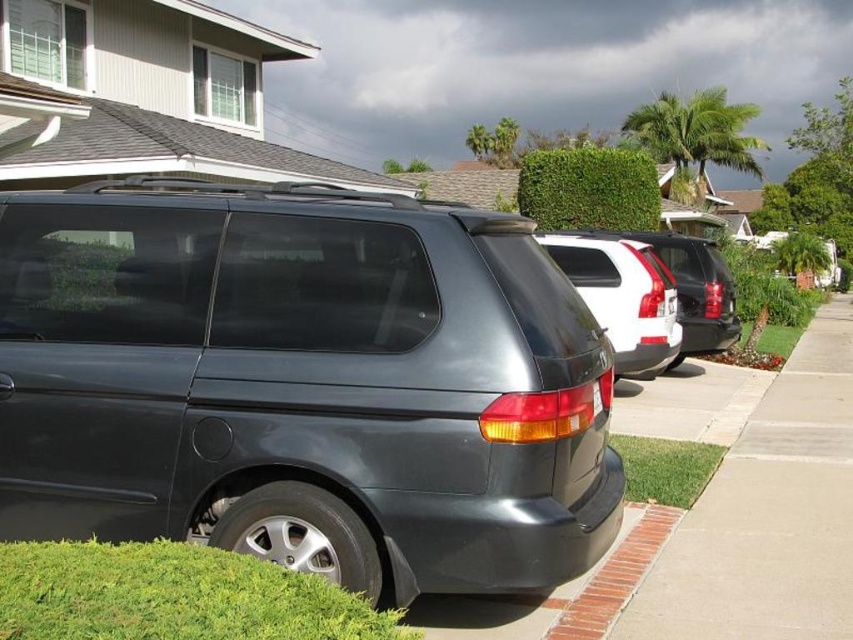
Question: Among these points, which one is farthest from the camera?

Choices:
 (A) coord(830,314)
 (B) coord(134,246)

Answer: (A)

Question: Does concrete at center appear on the left side of white matte suv at center?

Choices:
 (A) yes
 (B) no

Answer: (B)

Question: Can you confirm if satin dark gray minivan at center is positioned below concrete at center?

Choices:
 (A) yes
 (B) no

Answer: (B)

Question: Can you confirm if concrete at center is smaller than white matte suv at center?

Choices:
 (A) yes
 (B) no

Answer: (B)

Question: Which object is positioned closest to the brick at lower right?

Choices:
 (A) white matte suv at center
 (B) concrete at center
 (C) satin dark gray minivan at center

Answer: (B)

Question: Which point appears farthest from the camera in this image?

Choices:
 (A) (637, 305)
 (B) (746, 499)

Answer: (A)